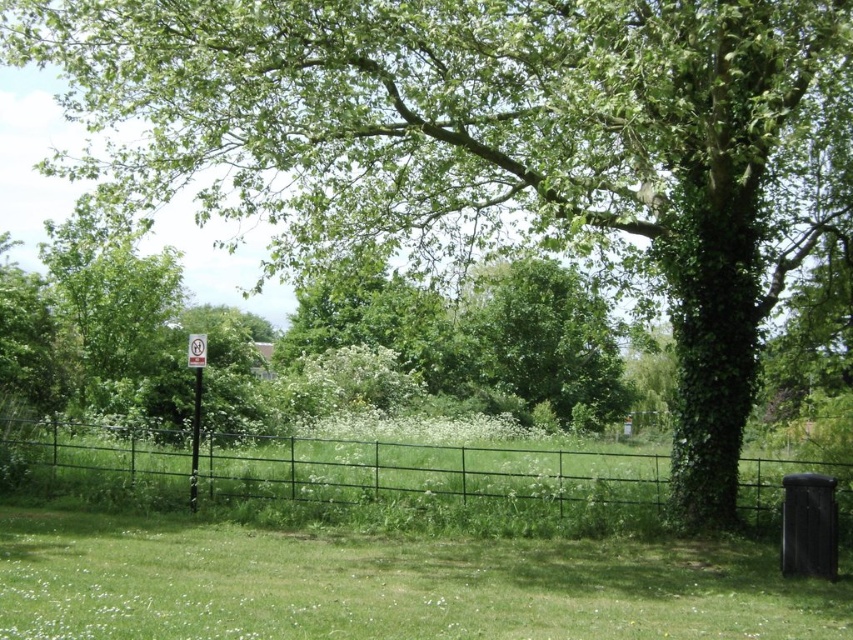
You are planning to install a new bench in the park. The bench will be placed where the metallic signpost at left currently is. To ensure visitors can see the tree from the bench, will the green leafy tree at center be visible from that spot?

The green leafy tree at center is above the metallic signpost at left, so when the bench is placed there, visitors will be able to see the tree as it is positioned above the signpost.

You are a park visitor trying to take a photo of the green leafy tree at center and the metallic signpost at left. Which object will appear wider in your camera view?

The green leafy tree at center will appear wider in your camera view since its width surpasses that of the metallic signpost at left.